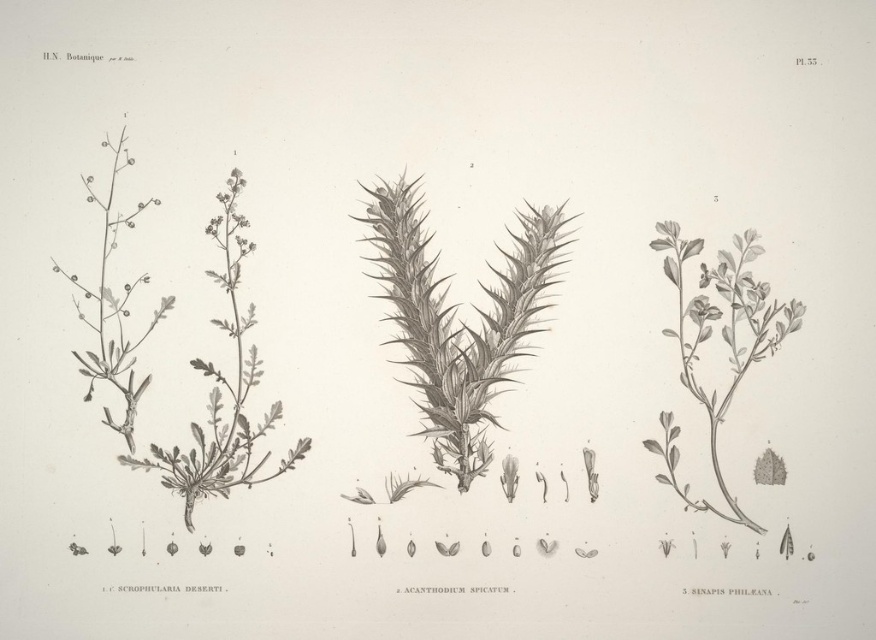
You are a botanist examining the illustration and need to determine which plant is closer to you. You see the gray textured plant at center and the green leafy plant at center right. Which one is closer?

The gray textured plant at center is closer to you than the green leafy plant at center right.

You are a botanist examining the botanical illustration. You need to identify the spatial relationship between the gray textured plant at center and the green leafy plant at center right. Which one is located to the left of the other?

The gray textured plant at center is positioned on the left side of green leafy plant at center right.